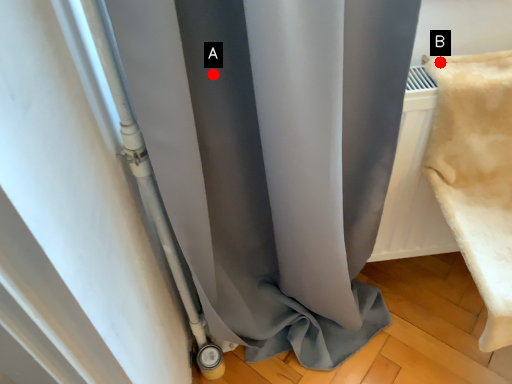
Question: Two points are circled on the image, labeled by A and B beside each circle. Which point is further to the camera?

Choices:
 (A) A is further
 (B) B is further

Answer: (B)